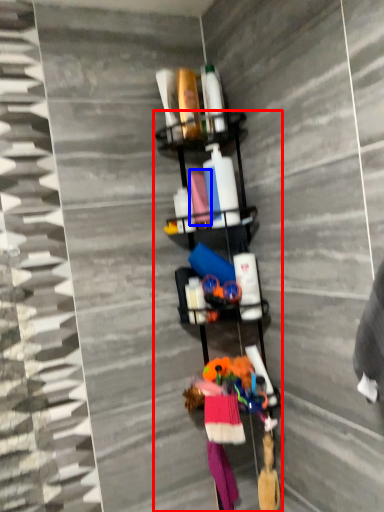
Question: Which object appears closest to the camera in this image, shelf (highlighted by a red box) or fabric (highlighted by a blue box)?

Choices:
 (A) shelf
 (B) fabric

Answer: (A)